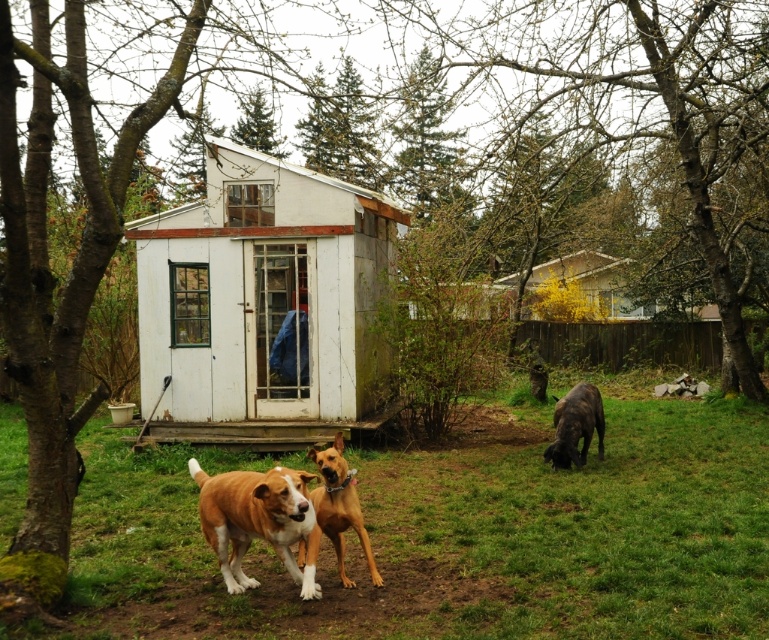
You are standing in the backyard and want to walk from the green grass at center to the white wood shed at center. Which direction should you move relative to the shed?

The green grass at center is positioned on the right side of white wood shed at center, so to reach the shed from the grass, you should move to the left towards the shed.

You are standing in the backyard and want to place a small garden gnome exactly at the location of point (x=571, y=253) and another gnome at point (x=603, y=420). According to the scene, which gnome will be closer to the shed with the open door?

Point (x=571, y=253) is behind point (x=603, y=420), so the gnome at point (x=603, y=420) will be closer to the shed with the open door.